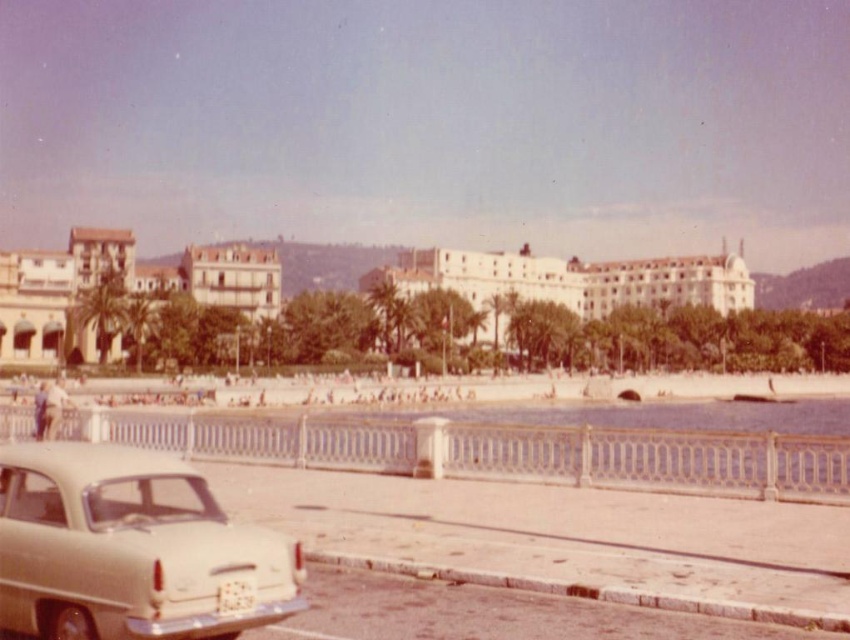
Between beige matte car at lower left and white textured building at center, which one appears on the left side from the viewer's perspective?

From the viewer's perspective, beige matte car at lower left appears more on the left side.

Who is more forward, (111, 566) or (578, 291)?

Point (111, 566) is more forward.

Between point (202, 531) and point (468, 289), which one is positioned behind?

Positioned behind is point (468, 289).

The width and height of the screenshot is (850, 640). I want to click on beige matte car at lower left, so click(131, 548).

Where is `beige stucco building at left`? The height and width of the screenshot is (640, 850). beige stucco building at left is located at coordinates (120, 288).

Between beige stucco building at left and white textured building at center, which one is positioned lower?

beige stucco building at left is below.

This screenshot has height=640, width=850. What are the coordinates of `beige stucco building at left` in the screenshot? It's located at (120, 288).

Which is more to the left, beige matte car at lower left or beige stucco building at left?

From the viewer's perspective, beige stucco building at left appears more on the left side.

Does beige matte car at lower left lie in front of beige stucco building at left?

Yes, beige matte car at lower left is closer to the viewer.

This screenshot has width=850, height=640. In order to click on beige matte car at lower left in this screenshot , I will do [x=131, y=548].